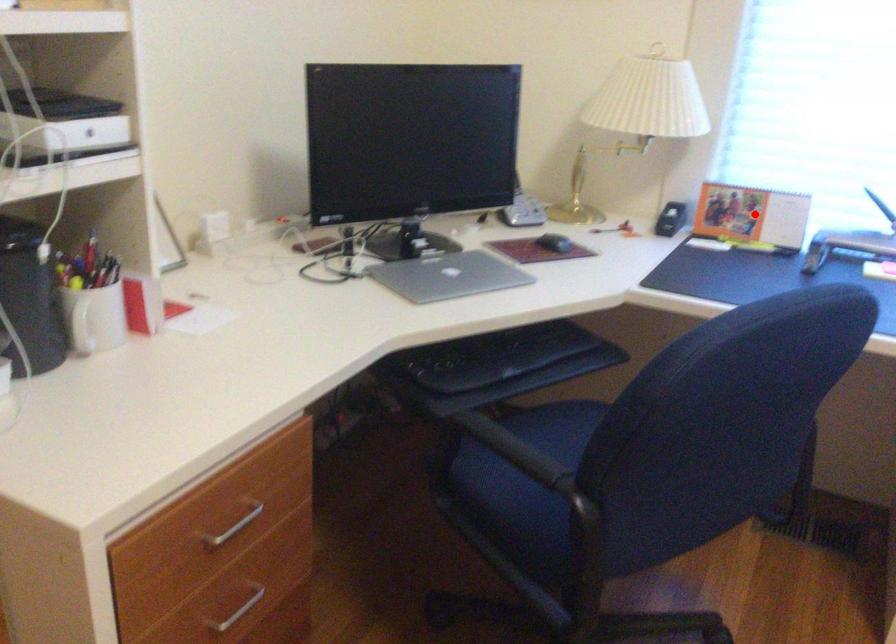
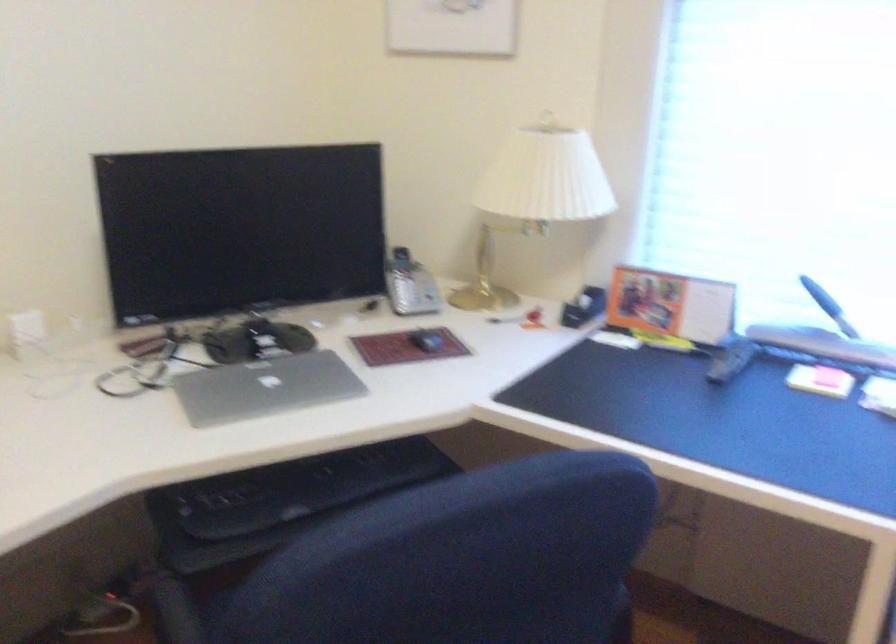
Locate, in the second image, the point that corresponds to the highlighted location in the first image.

(670, 305)